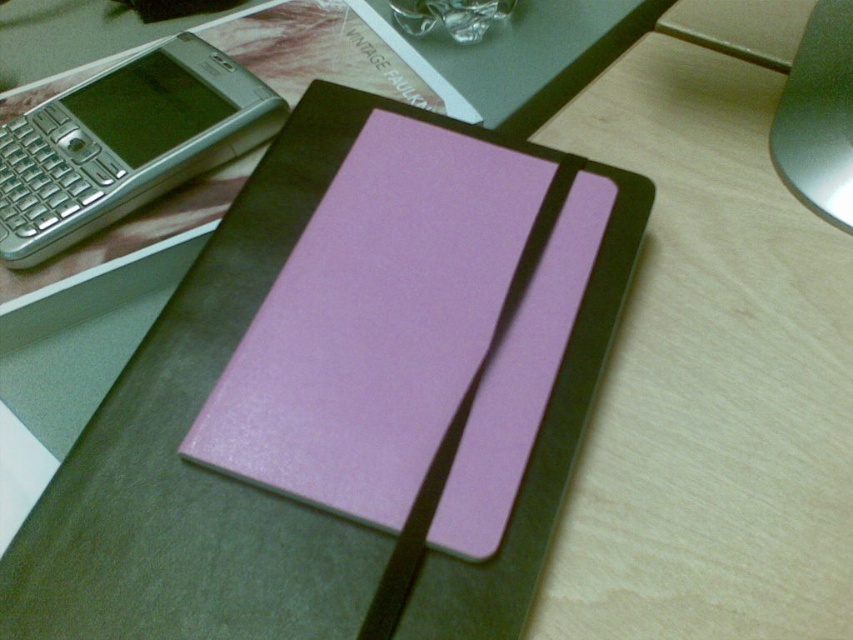
Is lavender matte notepad at center smaller than silver metallic smartphone at upper left?

No, lavender matte notepad at center is not smaller than silver metallic smartphone at upper left.

Which is more to the right, lavender matte notepad at center or silver metallic smartphone at upper left?

From the viewer's perspective, lavender matte notepad at center appears more on the right side.

What are the coordinates of `lavender matte notepad at center` in the screenshot? It's located at (405, 336).

Where is `lavender matte notepad at center`? The width and height of the screenshot is (853, 640). lavender matte notepad at center is located at coordinates (405, 336).